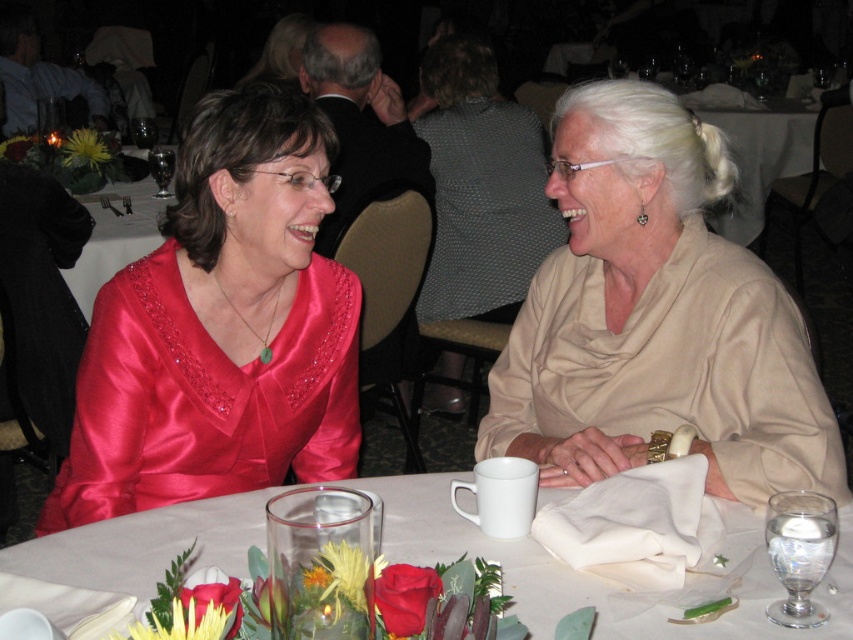
Does satin dress at left appear on the left side of white matte napkin at lower center?

Correct, you'll find satin dress at left to the left of white matte napkin at lower center.

Does satin dress at left appear over white matte napkin at lower center?

Indeed, satin dress at left is positioned over white matte napkin at lower center.

Between point (257, 278) and point (103, 548), which one is positioned in front?

Positioned in front is point (103, 548).

Find the location of `satin dress at left`. satin dress at left is located at coordinates (219, 330).

Who is positioned more to the right, beige satin blouse at right or satin dress at left?

From the viewer's perspective, beige satin blouse at right appears more on the right side.

Is beige satin blouse at right closer to the viewer compared to satin dress at left?

Yes, beige satin blouse at right is in front of satin dress at left.

Does point (543, 301) lie in front of point (134, 296)?

No, it is behind (134, 296).

You are a GUI agent. You are given a task and a screenshot of the screen. Output one action in this format:
    pyautogui.click(x=<x>, y=<y>)
    Task: Click on the beige satin blouse at right
    The width and height of the screenshot is (853, 640).
    Given the screenshot: What is the action you would take?
    pyautogui.click(x=654, y=317)

Who is positioned more to the right, beige satin blouse at right or white matte napkin at lower center?

From the viewer's perspective, beige satin blouse at right appears more on the right side.

Which is behind, point (618, 376) or point (676, 611)?

Point (618, 376)

Is point (775, 458) less distant than point (552, 586)?

That is False.

Find the location of `beige satin blouse at right`. beige satin blouse at right is located at coordinates (654, 317).